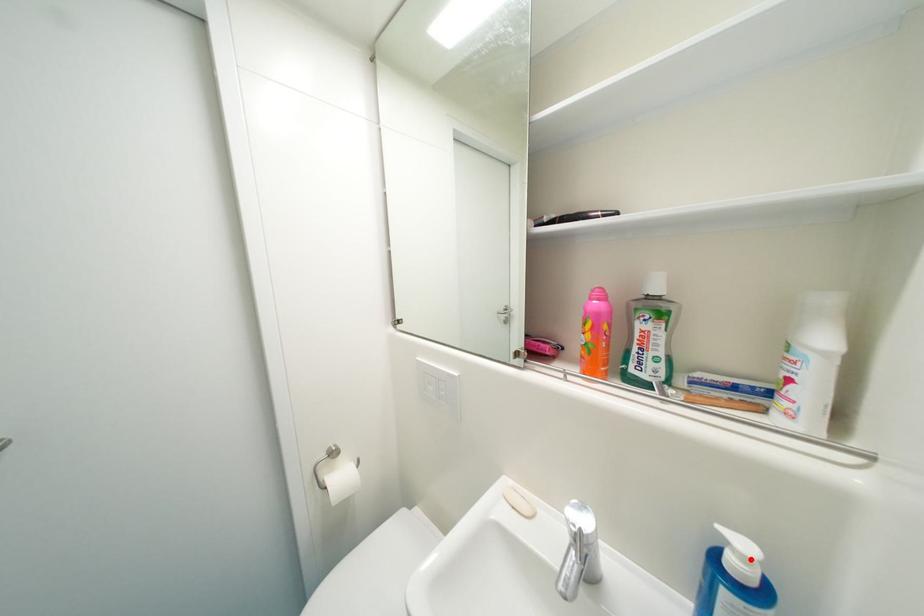
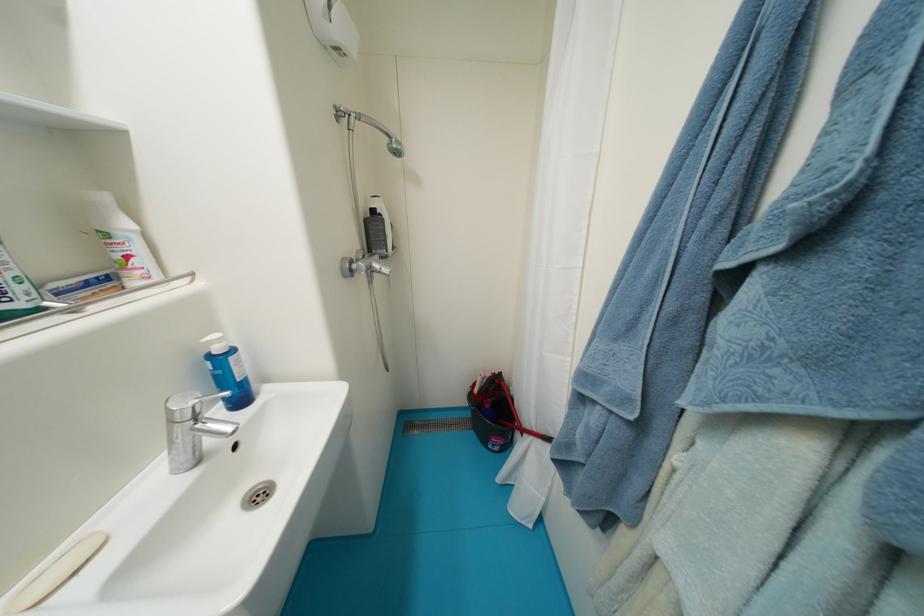
In the second image, find the point that corresponds to the highlighted location in the first image.

(225, 342)